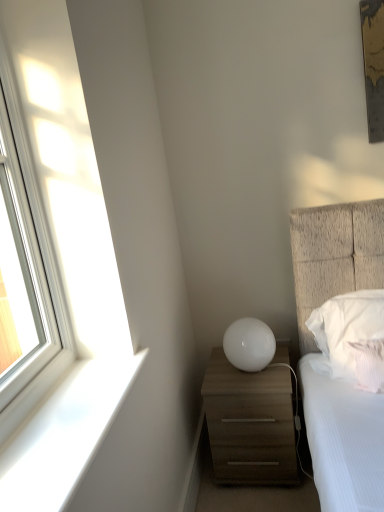
At what (x,y) coordinates should I click in order to perform the action: click on free spot to the left of white glossy sphere at center. Please return your answer as a coordinate pair (x, y). This screenshot has width=384, height=512. Looking at the image, I should click on click(215, 374).